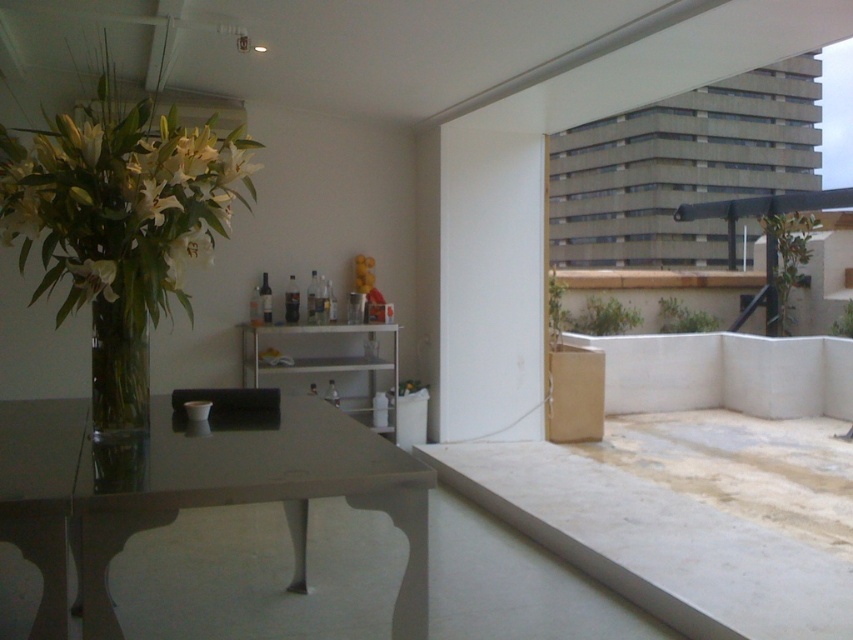
Between point (42, 499) and point (113, 344), which one is positioned in front?

Point (42, 499) is in front.

Describe the element at coordinates (190, 493) in the screenshot. This screenshot has height=640, width=853. I see `glossy glass table at center` at that location.

Is point (45, 484) behind point (111, 401)?

No, it is not.

This screenshot has width=853, height=640. What are the coordinates of `glossy glass table at center` in the screenshot? It's located at (190, 493).

Is glossy glass table at center shorter than translucent glass vase at left?

Incorrect, glossy glass table at center's height does not fall short of translucent glass vase at left's.

Between glossy glass table at center and translucent glass vase at left, which one has more height?

With more height is glossy glass table at center.

Is point (256, 460) less distant than point (103, 289)?

Yes.

The height and width of the screenshot is (640, 853). What are the coordinates of `glossy glass table at center` in the screenshot? It's located at (190, 493).

Is clear glass vase at left positioned before translucent glass vase at left?

That is False.

Between point (109, 385) and point (77, 276), which one is positioned in front?

Point (77, 276) is in front.

Is point (106, 397) closer to viewer compared to point (107, 292)?

No, (106, 397) is further to viewer.

Where is `clear glass vase at left`? The width and height of the screenshot is (853, 640). clear glass vase at left is located at coordinates (119, 371).